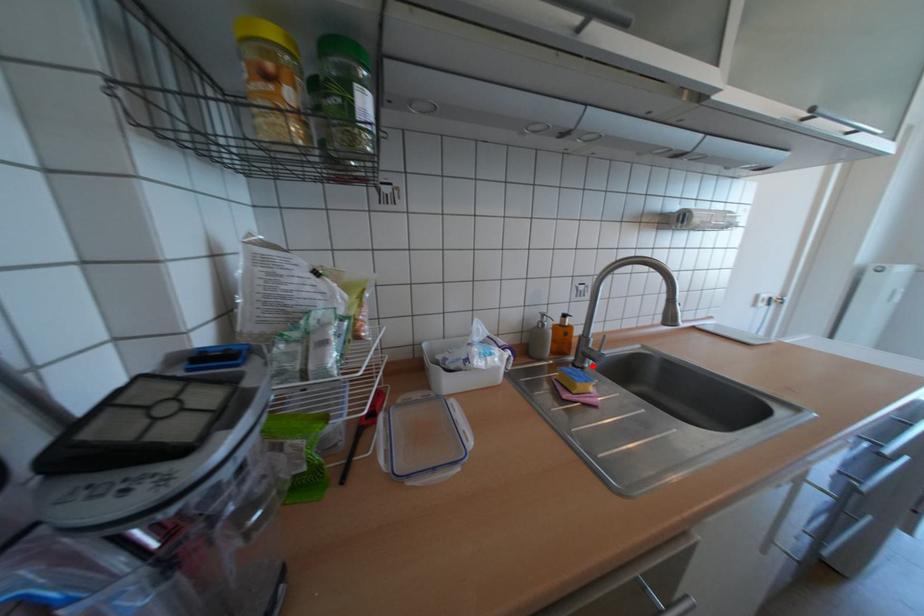
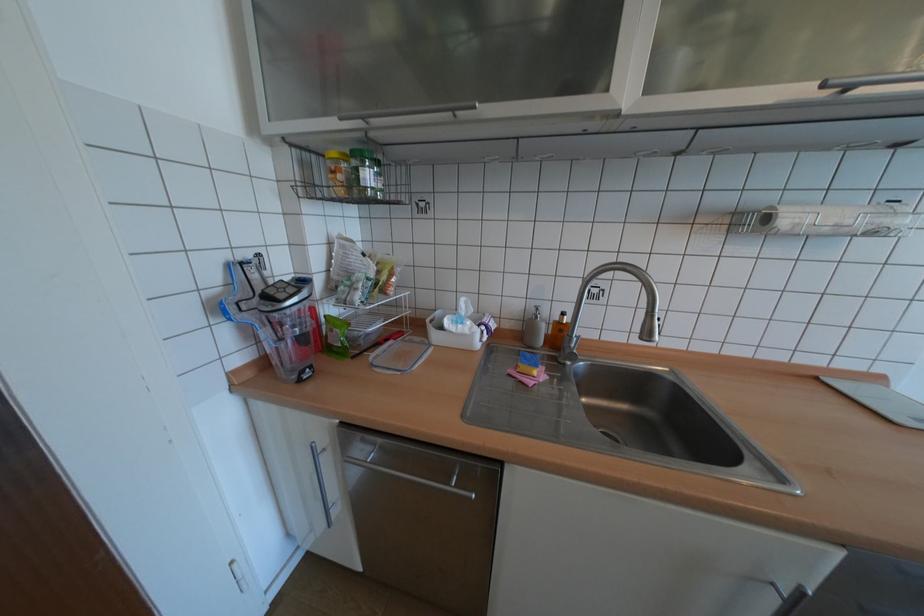
In the second image, find the point that corresponds to the highlighted location in the first image.

(574, 363)